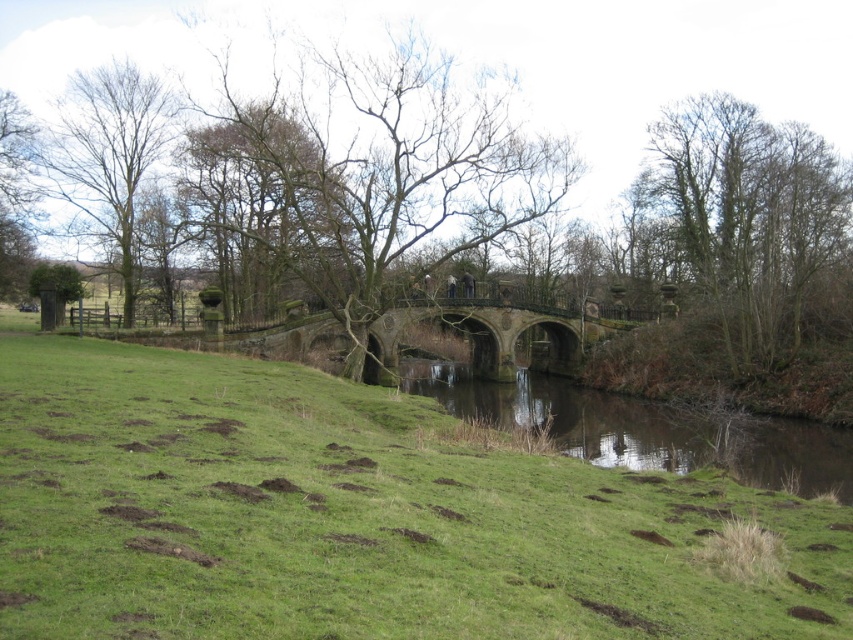
Question: Estimate the real-world distances between objects in this image. Which object is farther from the green grassy at center?

Choices:
 (A) brown leafless tree at center
 (B) bare branches at center

Answer: (A)

Question: Is green grassy at center bigger than bare branches at center?

Choices:
 (A) no
 (B) yes

Answer: (A)

Question: Which object is positioned farthest from the green leafy tree at right?

Choices:
 (A) rusty stone bridge at center
 (B) bare branches at center
 (C) green grassy at center
 (D) brown leafless tree at center

Answer: (C)

Question: Does brown leafless tree at center have a larger size compared to bare branches at center?

Choices:
 (A) yes
 (B) no

Answer: (A)

Question: Which point appears closest to the camera in this image?

Choices:
 (A) (787, 276)
 (B) (566, 362)

Answer: (A)

Question: Does brown leafless tree at center have a larger size compared to bare branches at center?

Choices:
 (A) yes
 (B) no

Answer: (A)